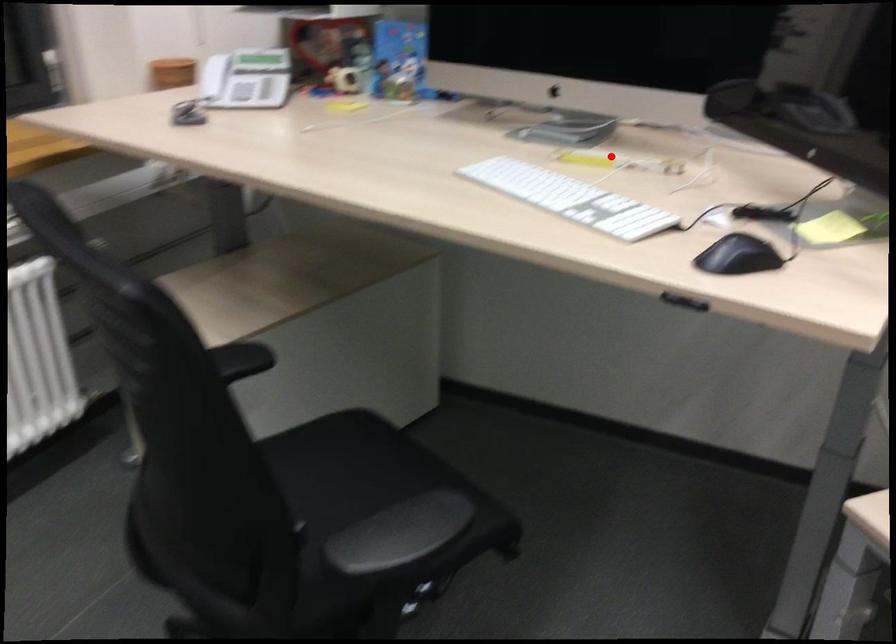
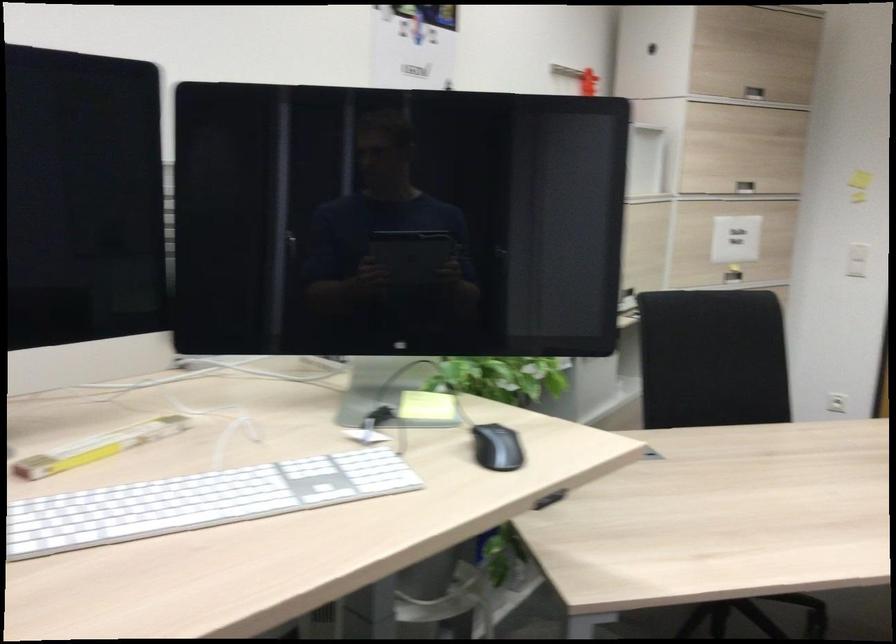
Where in the second image is the point corresponding to the highlighted location from the first image?

(98, 447)